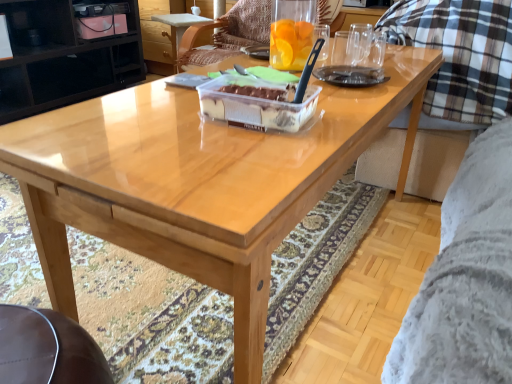
Question: From the image's perspective, is black glossy cabinet at upper left over translucent plastic cake at center?

Choices:
 (A) yes
 (B) no

Answer: (A)

Question: Is black glossy cabinet at upper left smaller than translucent plastic cake at center?

Choices:
 (A) yes
 (B) no

Answer: (B)

Question: Considering the relative sizes of black glossy cabinet at upper left and translucent plastic cake at center in the image provided, is black glossy cabinet at upper left shorter than translucent plastic cake at center?

Choices:
 (A) no
 (B) yes

Answer: (A)

Question: From a real-world perspective, is black glossy cabinet at upper left below translucent plastic cake at center?

Choices:
 (A) no
 (B) yes

Answer: (B)

Question: Can you confirm if black glossy cabinet at upper left is positioned to the left of translucent plastic cake at center?

Choices:
 (A) no
 (B) yes

Answer: (B)

Question: Is point (256, 26) positioned closer to the camera than point (218, 86)?

Choices:
 (A) farther
 (B) closer

Answer: (A)

Question: Choose the correct answer: Is wooden chair at center inside translucent plastic cake at center or outside it?

Choices:
 (A) inside
 (B) outside

Answer: (B)

Question: From a real-world perspective, is wooden chair at center positioned above or below translucent plastic cake at center?

Choices:
 (A) below
 (B) above

Answer: (A)

Question: Considering their positions, is wooden chair at center located in front of or behind translucent plastic cake at center?

Choices:
 (A) behind
 (B) front

Answer: (A)

Question: Is translucent plastic cake at center bigger or smaller than black glossy cabinet at upper left?

Choices:
 (A) big
 (B) small

Answer: (B)

Question: From a real-world perspective, is translucent plastic cake at center above or below black glossy cabinet at upper left?

Choices:
 (A) above
 (B) below

Answer: (A)

Question: In terms of width, does translucent plastic cake at center look wider or thinner when compared to black glossy cabinet at upper left?

Choices:
 (A) wide
 (B) thin

Answer: (B)

Question: Is translucent plastic cake at center taller or shorter than black glossy cabinet at upper left?

Choices:
 (A) tall
 (B) short

Answer: (B)

Question: From their relative heights in the image, would you say wooden chair at center is taller or shorter than black glossy cabinet at upper left?

Choices:
 (A) short
 (B) tall

Answer: (A)

Question: From the image's perspective, is wooden chair at center located above or below black glossy cabinet at upper left?

Choices:
 (A) above
 (B) below

Answer: (B)